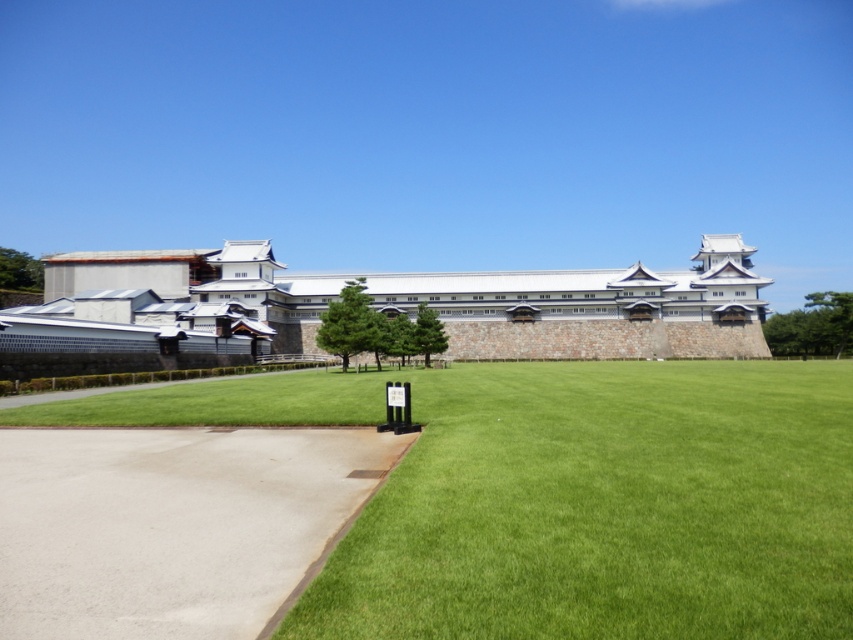
In the scene shown: Measure the distance between point (x=544, y=632) and camera.

The distance of point (x=544, y=632) from camera is 11.61 feet.

Who is positioned more to the left, green grass at center or white stone wall at center?

white stone wall at center

Is point (521, 522) closer to viewer compared to point (573, 342)?

Yes, it is.

The image size is (853, 640). Identify the location of green grass at center. (569, 497).

Can you confirm if smooth concrete path at lower left is positioned to the left of white stone wall at center?

Yes, smooth concrete path at lower left is to the left of white stone wall at center.

Is smooth concrete path at lower left above white stone wall at center?

Incorrect, smooth concrete path at lower left is not positioned above white stone wall at center.

Between point (115, 563) and point (561, 284), which one is positioned in front?

Point (115, 563) is more forward.

Identify the location of smooth concrete path at lower left. (170, 525).

Who is higher up, green grass at center or smooth concrete path at lower left?

smooth concrete path at lower left

The width and height of the screenshot is (853, 640). I want to click on green grass at center, so click(x=569, y=497).